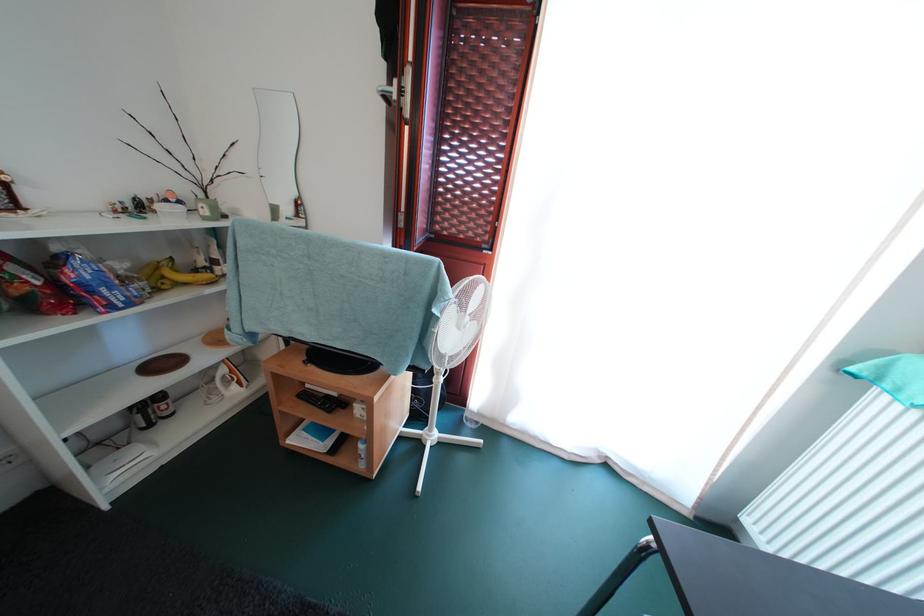
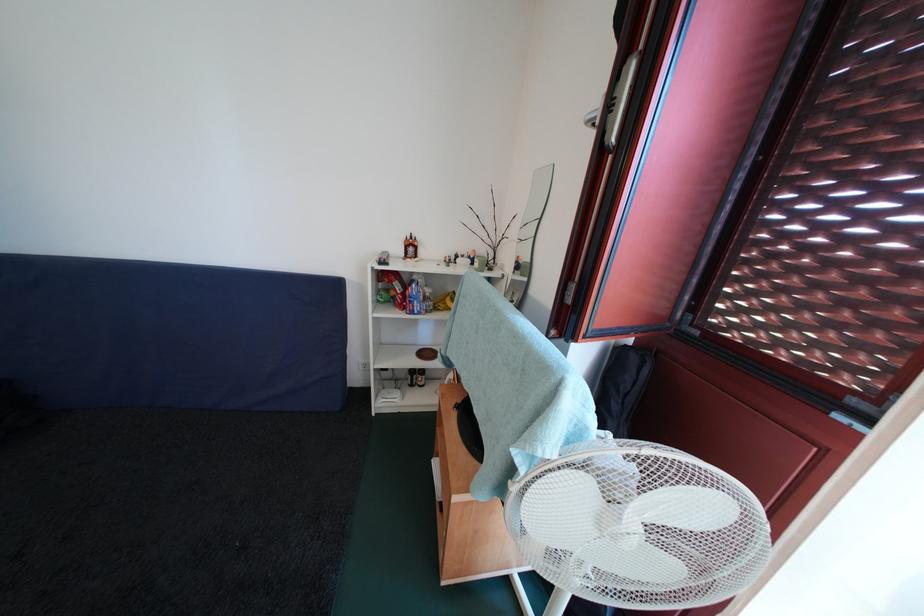
Where in the second image is the point corresponding to point (34, 286) from the first image?

(403, 296)